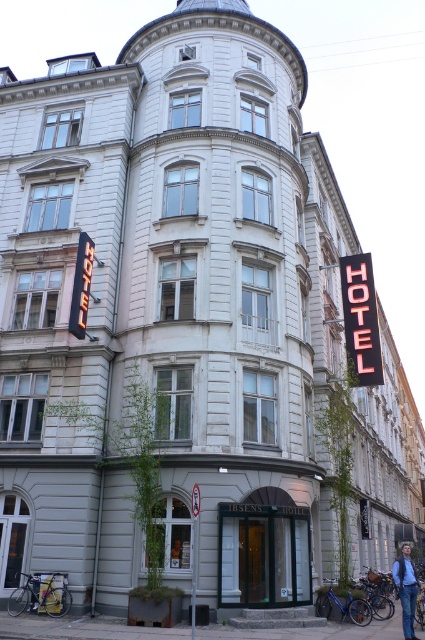
Does point (357, 285) come farther from viewer compared to point (411, 589)?

Yes, point (357, 285) is behind point (411, 589).

Is point (365, 340) less distant than point (408, 589)?

No.

Who is more distant from viewer, (359, 276) or (402, 589)?

The point (359, 276) is behind.

Image resolution: width=425 pixels, height=640 pixels. In order to click on neon/black hotel sign at upper right in this screenshot , I will do `click(360, 321)`.